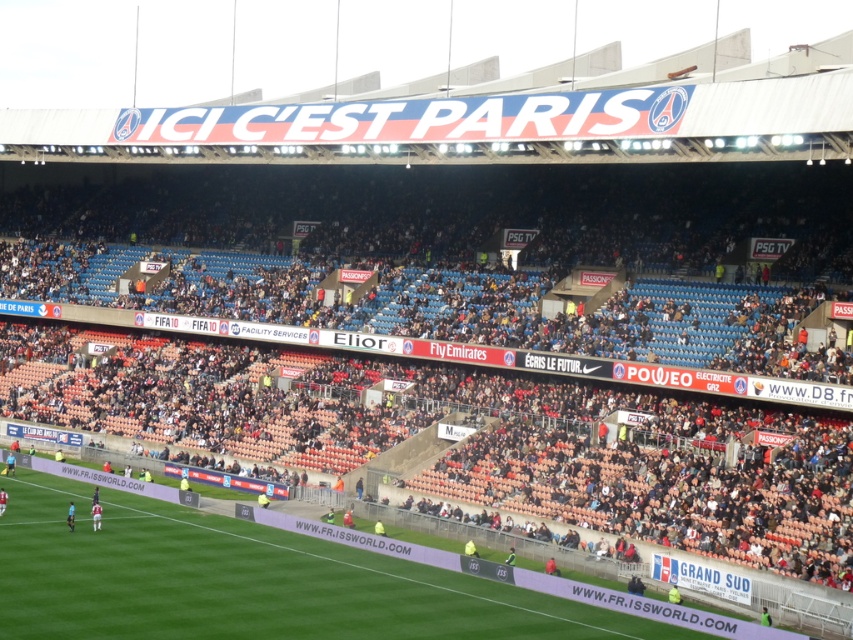
Is orange plastic seats at center to the left of green grass football field at center from the viewer's perspective?

In fact, orange plastic seats at center is to the right of green grass football field at center.

Can you confirm if orange plastic seats at center is taller than green grass football field at center?

Yes, orange plastic seats at center is taller than green grass football field at center.

At what (x,y) coordinates should I click in order to perform the action: click on orange plastic seats at center. Please return your answer as a coordinate pair (x, y). Looking at the image, I should click on (509, 445).

The image size is (853, 640). I want to click on orange plastic seats at center, so click(509, 445).